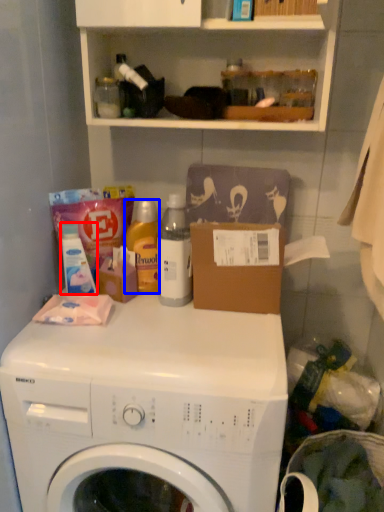
Question: Which point is further to the camera, toiletry (highlighted by a red box) or cleaning product (highlighted by a blue box)?

Choices:
 (A) toiletry
 (B) cleaning product

Answer: (B)